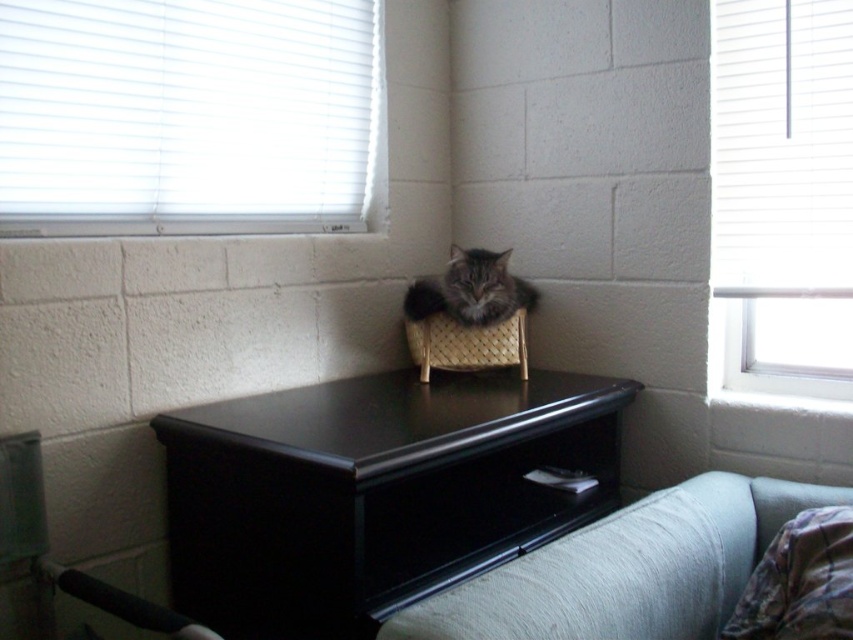
Question: Is black wood table at center to the left of black wood drawer at lower center from the viewer's perspective?

Choices:
 (A) no
 (B) yes

Answer: (B)

Question: Which is farther from the woven basket at center?

Choices:
 (A) gray tabby cat in woven basket at center
 (B) light gray fabric couch at lower right
 (C) black wood drawer at lower center
 (D) white blinds at upper left

Answer: (B)

Question: Is black wood drawer at lower center smaller than gray tabby cat in woven basket at center?

Choices:
 (A) no
 (B) yes

Answer: (A)

Question: Which point is closer to the camera?

Choices:
 (A) (508, 541)
 (B) (430, 298)
 (C) (824, 109)

Answer: (A)

Question: Which object is positioned farthest from the gray tabby cat in woven basket at center?

Choices:
 (A) woven basket at center
 (B) black wood drawer at lower center

Answer: (B)

Question: Does gray tabby cat in woven basket at center appear over woven basket at center?

Choices:
 (A) no
 (B) yes

Answer: (B)